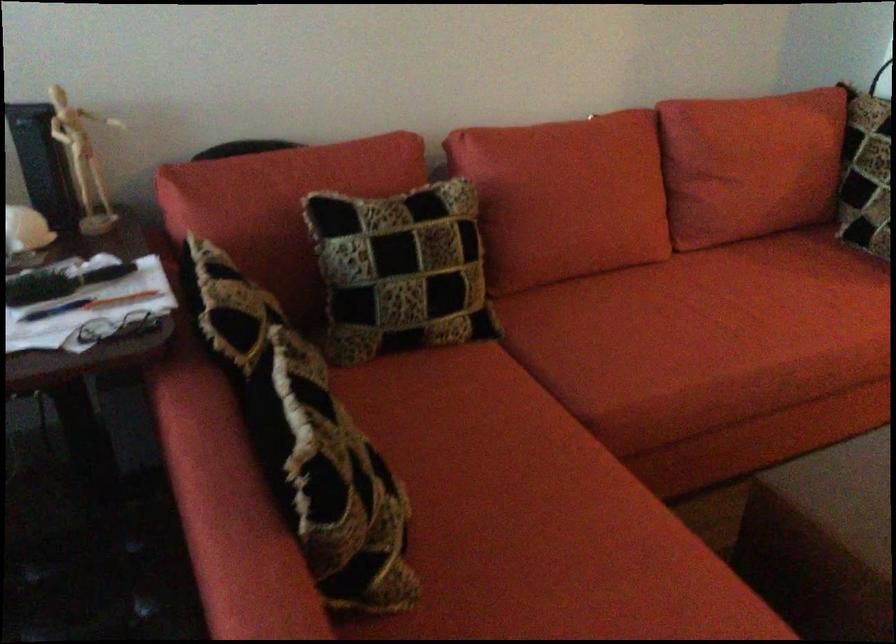
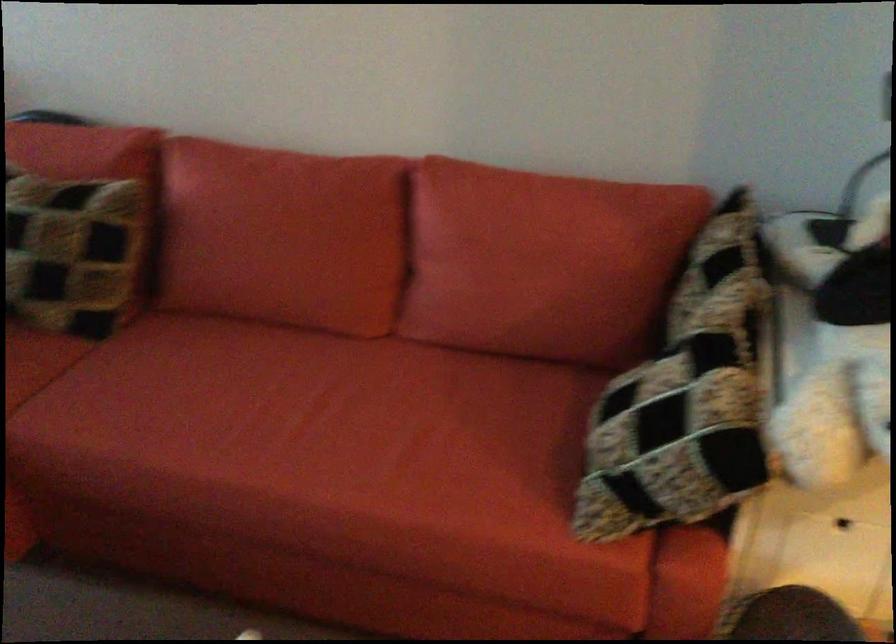
Where in the second image is the point corresponding to (442,223) from the first image?

(76, 223)